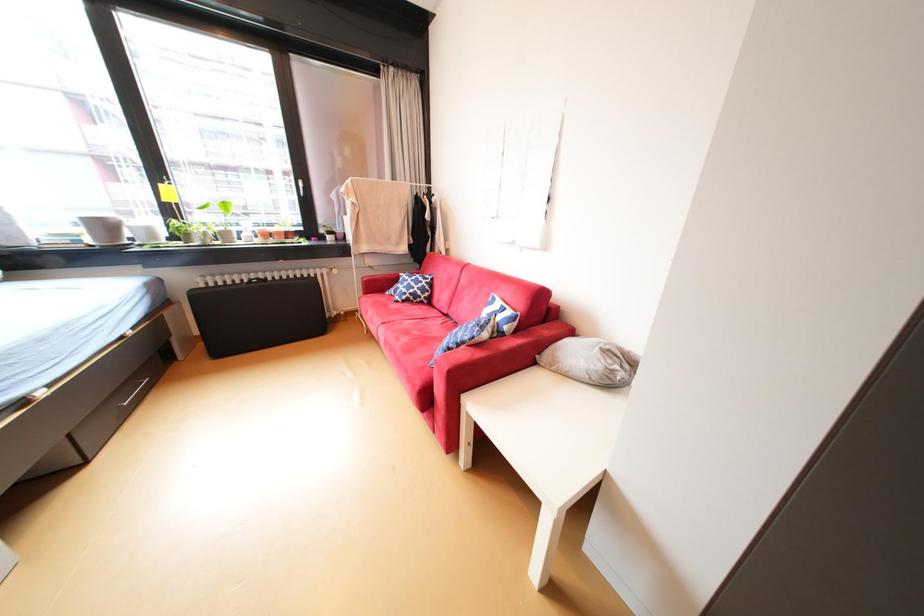
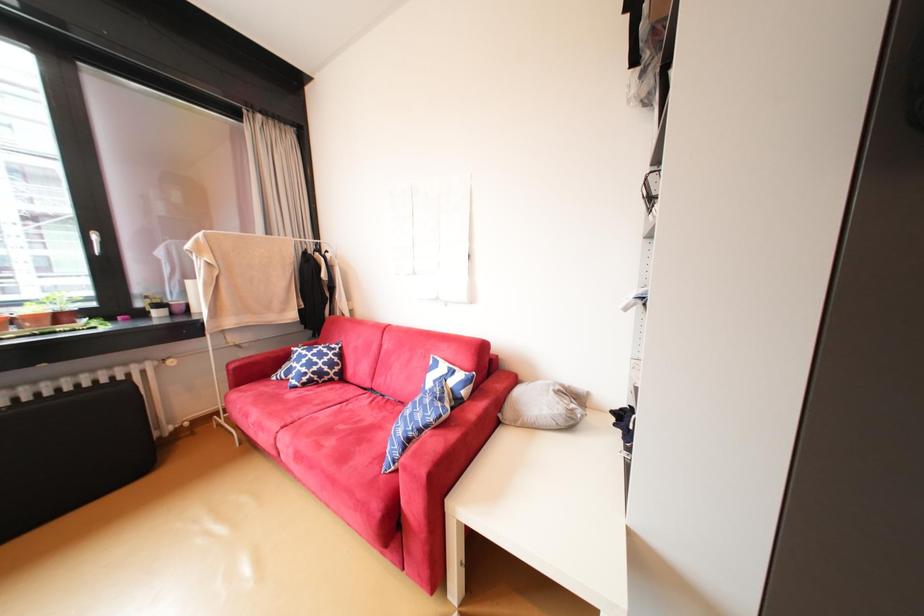
In a continuous first-person perspective shot, in which direction is the camera moving?

The movement direction of the cameraman is left, forward.